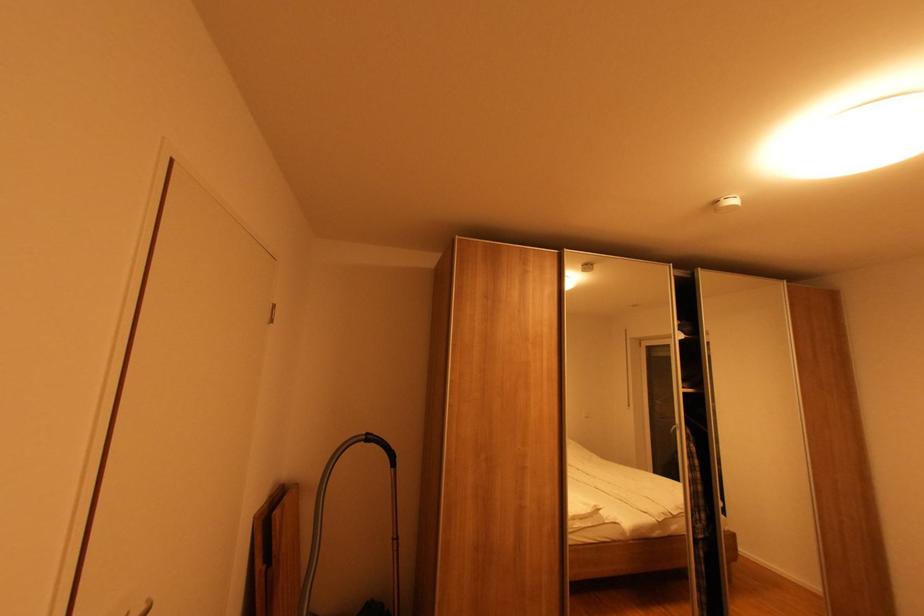
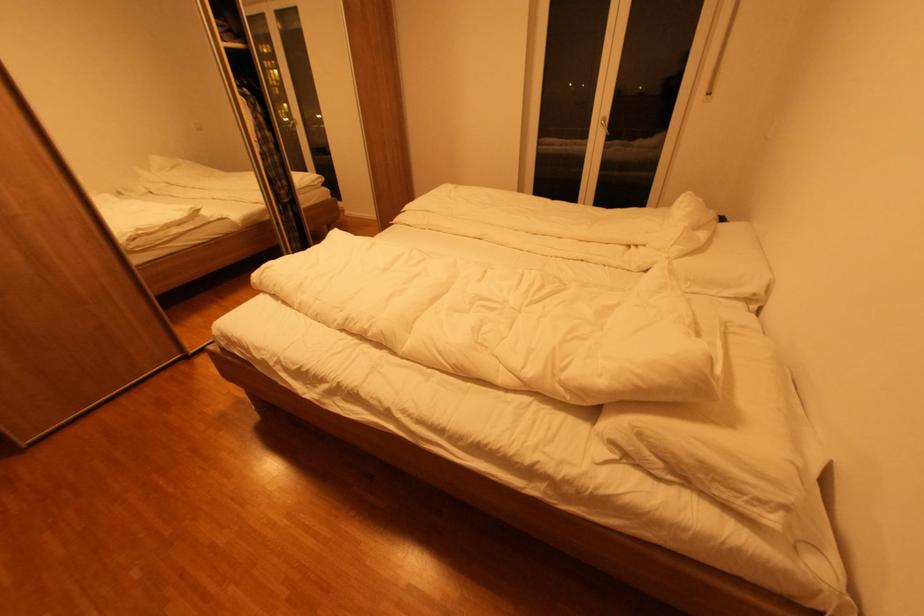
Based on the continuous images, in which direction is the camera rotating?

The camera's rotation is toward right-down.